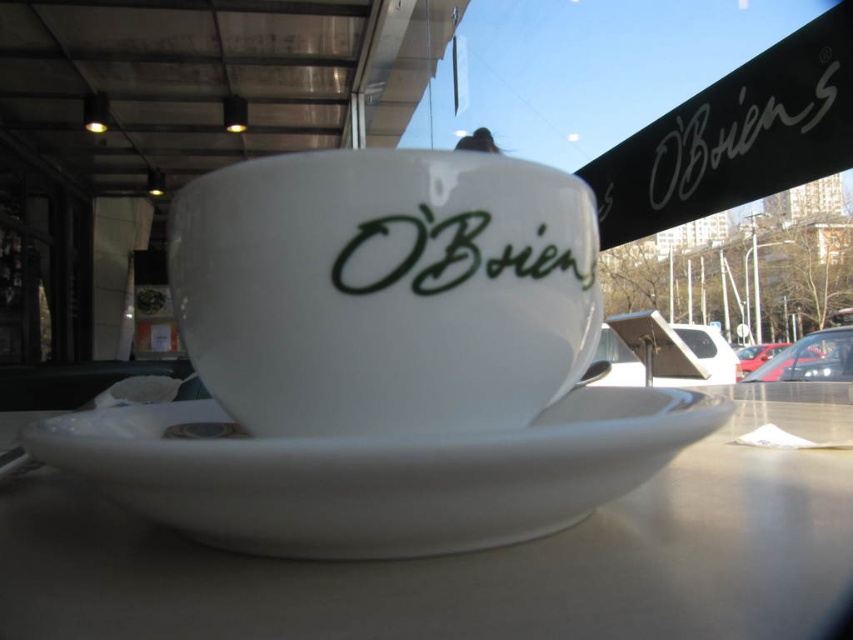
Is point (334, 442) positioned after point (521, 252)?

No.

Is white glossy saucer at center below green matte text at center?

Yes.

Is point (132, 448) closer to viewer compared to point (525, 264)?

Yes, point (132, 448) is closer to viewer.

Where is `white glossy saucer at center`? This screenshot has width=853, height=640. white glossy saucer at center is located at coordinates (375, 474).

Is point (97, 433) farther from camera compared to point (831, 68)?

No.

Based on the photo, is white glossy saucer at center thinner than white matte signboard at upper center?

Incorrect, white glossy saucer at center's width is not less than white matte signboard at upper center's.

I want to click on white glossy saucer at center, so click(375, 474).

Is white porcelain cup at center bigger than green matte text at center?

Correct, white porcelain cup at center is larger in size than green matte text at center.

Identify the location of white porcelain cup at center. (386, 289).